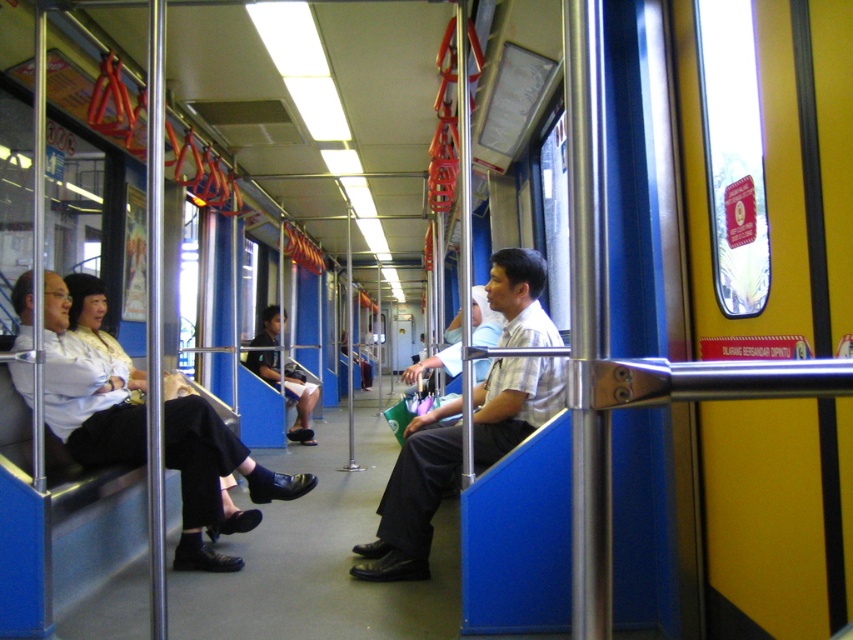
You are a passenger on the train and want to sit down. You see a matte white shirt at left and a dark blue fabric skirt at center. Which seat is closer to you?

The matte white shirt at left is in front of the dark blue fabric skirt at center, so the seat with the matte white shirt at left is closer to you.

You are a passenger in the train carriage and want to know if the light brown fabric shirt at center is blocking the view of the dark blue fabric skirt at center. Can you confirm?

The light brown fabric shirt at center is in front of the dark blue fabric skirt at center, so it is blocking the view of the dark blue fabric skirt at center.